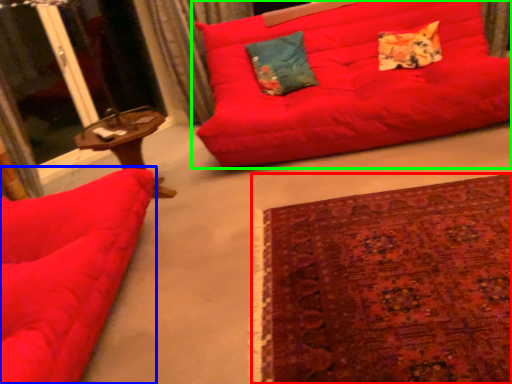
Question: Which object is the closest to the plain (highlighted by a red box)? Choose among these: studio couch (highlighted by a blue box) or studio couch (highlighted by a green box).

Choices:
 (A) studio couch
 (B) studio couch

Answer: (A)